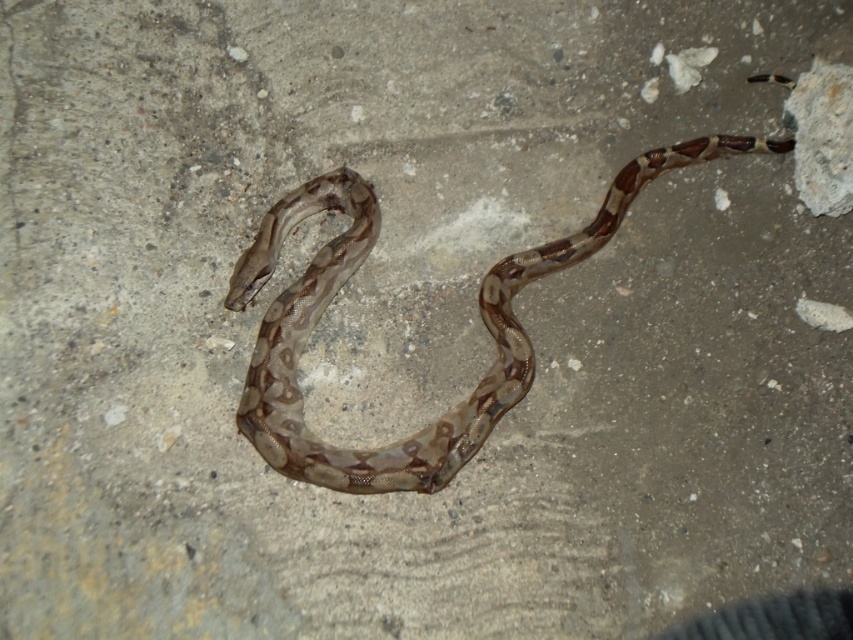
Is brown patterned snake at center positioned in front of speckled concrete rock at upper right?

Yes, it is in front of speckled concrete rock at upper right.

Can you confirm if brown patterned snake at center is positioned below speckled concrete rock at upper right?

Yes.

Does point (556, 264) come behind point (831, 80)?

That is True.

This screenshot has width=853, height=640. Identify the location of brown patterned snake at center. (479, 312).